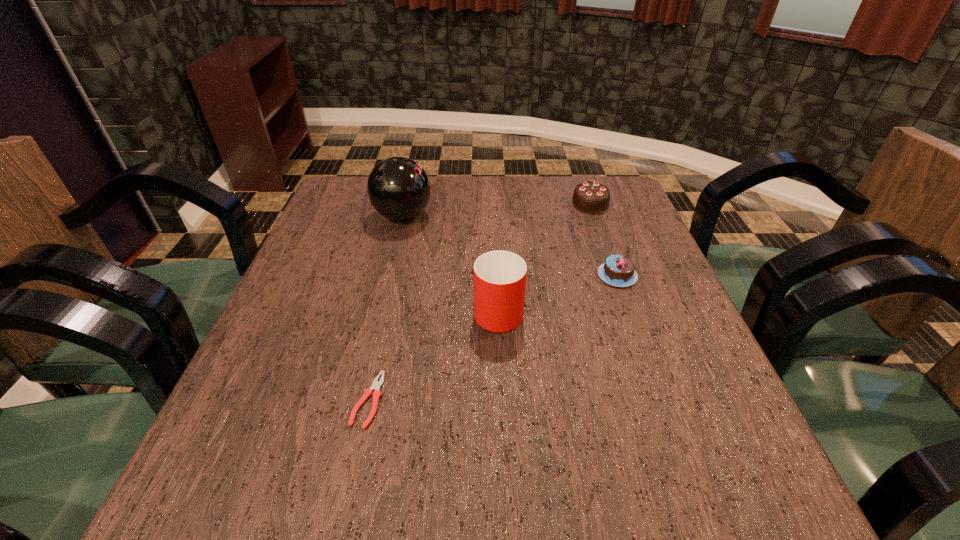
In order to click on object at the far right corner in this screenshot , I will do `click(592, 197)`.

The width and height of the screenshot is (960, 540). I want to click on vacant space at the far edge of the desktop, so click(519, 189).

Locate an element on the screen. This screenshot has width=960, height=540. vacant area at the near edge of the desktop is located at coordinates (333, 490).

Where is `vacant space at the left edge`? Image resolution: width=960 pixels, height=540 pixels. vacant space at the left edge is located at coordinates (346, 225).

Find the location of `vacant point at the right edge`. vacant point at the right edge is located at coordinates (612, 287).

Identify the location of vacant space at the far left corner of the desktop. This screenshot has height=540, width=960. (354, 201).

Where is `free region at the far right corner of the desktop`? free region at the far right corner of the desktop is located at coordinates (571, 183).

This screenshot has height=540, width=960. Find the location of `free space at the near right corner of the desktop`. free space at the near right corner of the desktop is located at coordinates (720, 484).

Where is `blank region between the tallest object and the third shortest object`? blank region between the tallest object and the third shortest object is located at coordinates (496, 210).

Where is `free area in between the nearest object and the second tallest object`? The image size is (960, 540). free area in between the nearest object and the second tallest object is located at coordinates (433, 354).